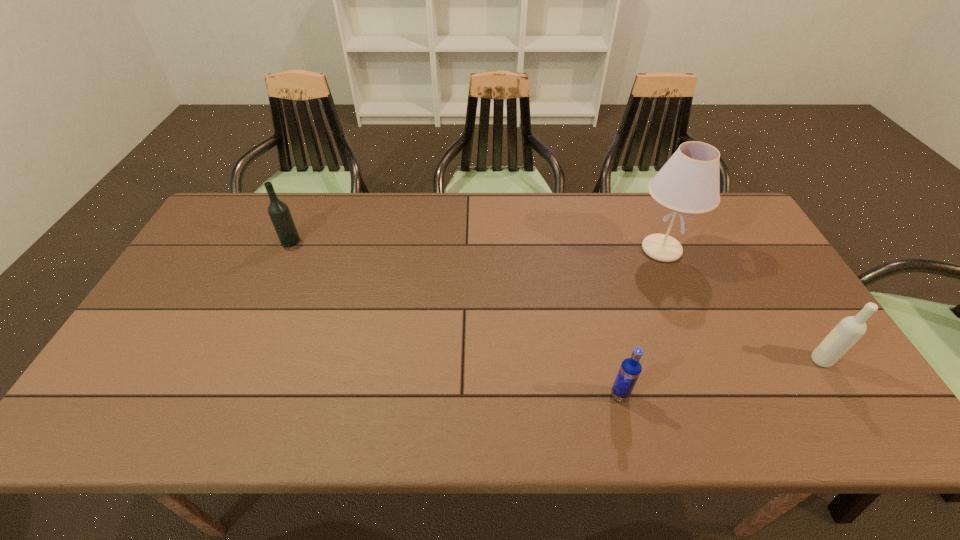
Where is `the third object from left to right`? the third object from left to right is located at coordinates (689, 182).

You are a GUI agent. You are given a task and a screenshot of the screen. Output one action in this format:
    pyautogui.click(x=<x>, y=<y>)
    Task: Click on the lampshade
    Image resolution: width=960 pixels, height=540 pixels.
    Given the screenshot: What is the action you would take?
    pyautogui.click(x=689, y=182)

The width and height of the screenshot is (960, 540). Identify the location of the farthest vodka. (279, 213).

Find the location of a particular element. The height and width of the screenshot is (540, 960). the leftmost vodka is located at coordinates (279, 213).

The height and width of the screenshot is (540, 960). In order to click on the rightmost vodka in this screenshot , I will do `click(849, 330)`.

This screenshot has width=960, height=540. Find the location of `the second farthest vodka`. the second farthest vodka is located at coordinates point(849,330).

Locate an element on the screen. the shortest vodka is located at coordinates (630, 369).

I want to click on the second object from left to right, so click(630, 369).

Locate an element on the screen. This screenshot has width=960, height=540. blank space located 0.090m on the right of the second object from right to left is located at coordinates (721, 250).

This screenshot has height=540, width=960. Find the location of `free space located on the right of the leftmost vodka`. free space located on the right of the leftmost vodka is located at coordinates (335, 241).